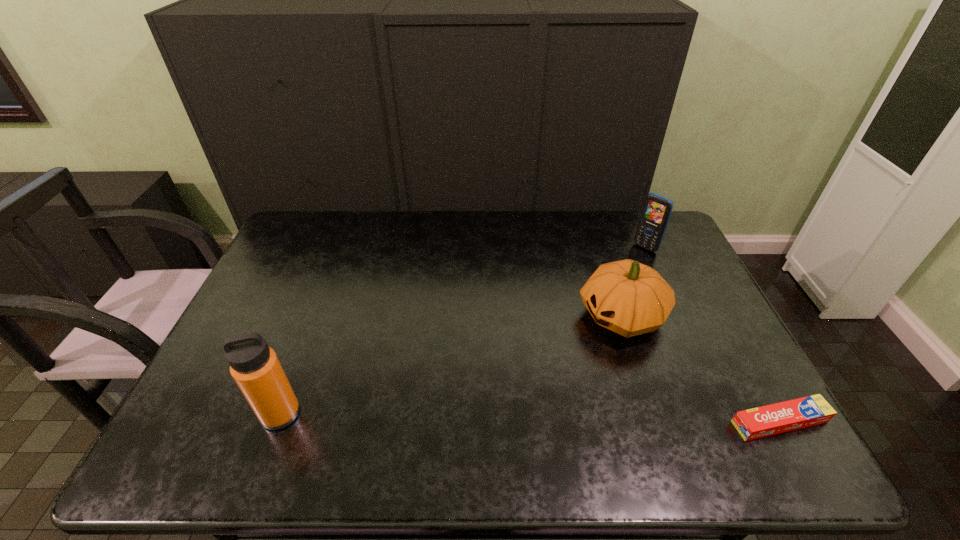
This screenshot has width=960, height=540. Identify the location of object that is at the near right corner. (768, 420).

At what (x,y) coordinates should I click in order to perform the action: click on free space at the far edge. Please return your answer as a coordinate pair (x, y). The height and width of the screenshot is (540, 960). Looking at the image, I should click on (538, 231).

This screenshot has height=540, width=960. In the image, there is a desktop. In order to click on vacant space at the near edge in this screenshot , I will do `click(690, 416)`.

Where is `vacant space at the left edge of the desktop`? This screenshot has height=540, width=960. vacant space at the left edge of the desktop is located at coordinates (263, 291).

This screenshot has height=540, width=960. Find the location of `free space at the far left corner of the desktop`. free space at the far left corner of the desktop is located at coordinates (288, 249).

You are a GUI agent. You are given a task and a screenshot of the screen. Output one action in this format:
    pyautogui.click(x=<x>, y=<y>)
    Task: Click on the vacant space at the near left corner of the desktop
    The image size is (960, 540).
    Given the screenshot: What is the action you would take?
    pyautogui.click(x=226, y=409)

Where is `free space between the shortest object and the gourd`? Image resolution: width=960 pixels, height=540 pixels. free space between the shortest object and the gourd is located at coordinates (701, 368).

This screenshot has width=960, height=540. In order to click on empty space between the shortest object and the farthest object in this screenshot , I will do `click(712, 335)`.

You are a GUI agent. You are given a task and a screenshot of the screen. Output one action in this format:
    pyautogui.click(x=<x>, y=<y>)
    Task: Click on the vacant region between the shortest object and the second farthest object
    The height and width of the screenshot is (540, 960).
    Given the screenshot: What is the action you would take?
    pyautogui.click(x=701, y=368)

At what (x,y) coordinates should I click in order to perform the action: click on vacant space that's between the third nearest object and the tallest object. Please return your answer as a coordinate pair (x, y). Image resolution: width=960 pixels, height=540 pixels. Looking at the image, I should click on (451, 364).